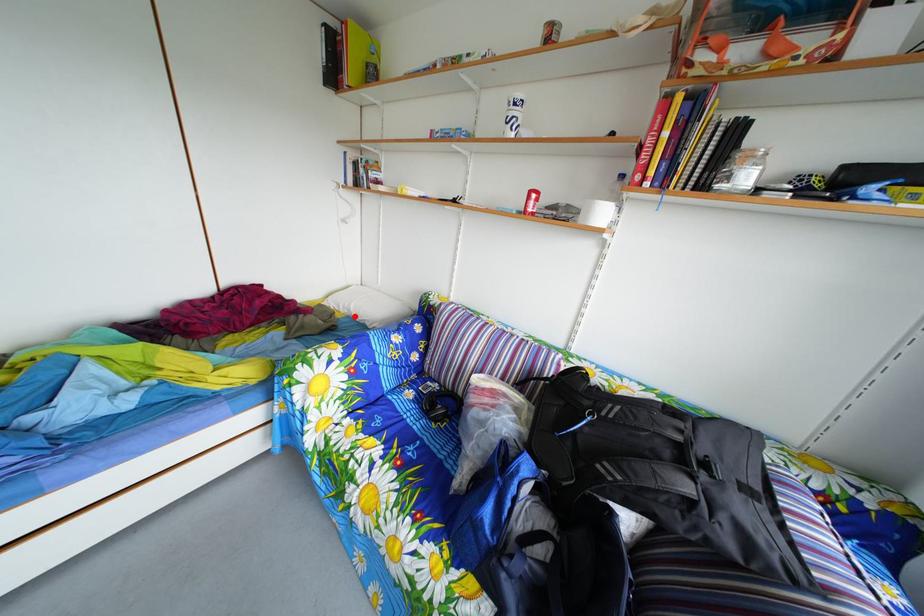
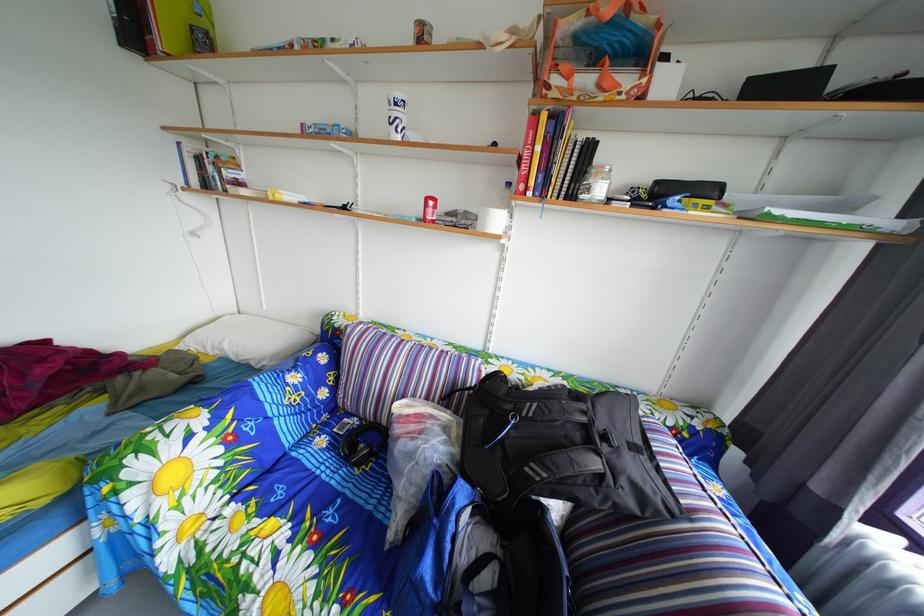
Where in the second image is the point corresponding to the highlighted location from the first image?

(224, 357)